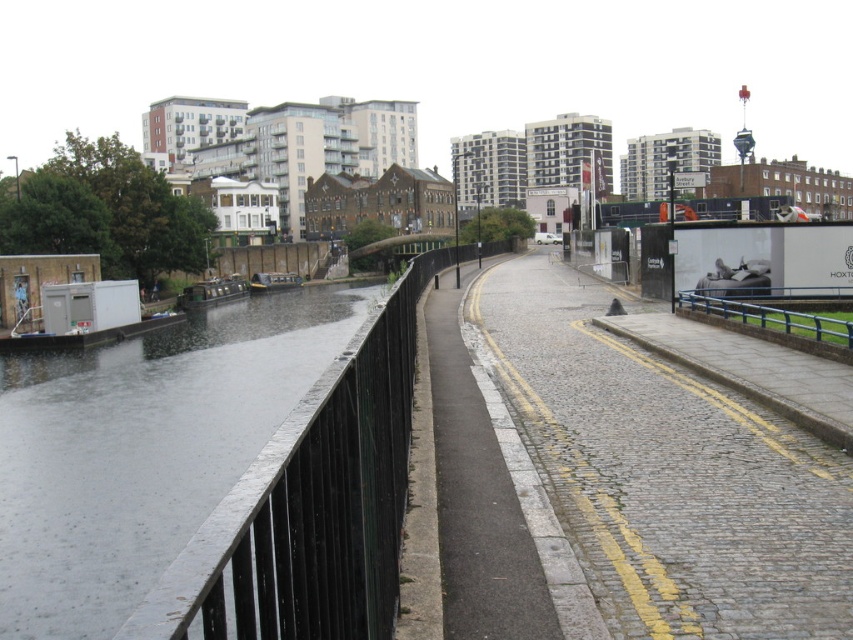
Does black metal water at left appear on the left side of black metal fence at left?

Yes, black metal water at left is to the left of black metal fence at left.

Does black metal water at left have a lesser height compared to black metal fence at left?

Correct, black metal water at left is not as tall as black metal fence at left.

Which is in front, point (334, 321) or point (409, 340)?

Point (409, 340) is more forward.

Find the location of a particular element. This screenshot has height=640, width=853. black metal water at left is located at coordinates (143, 449).

Can you confirm if blue metallic rail at right is positioned below green matte canal boat at left?

Indeed, blue metallic rail at right is positioned under green matte canal boat at left.

Based on the photo, who is positioned more to the right, blue metallic rail at right or green matte canal boat at left?

blue metallic rail at right is more to the right.

Find the location of a particular element. blue metallic rail at right is located at coordinates (772, 317).

Does black metal fence at left lie behind green matte boat at left?

No, black metal fence at left is closer to the viewer.

How distant is black metal fence at left from green matte boat at left?

A distance of 34.50 meters exists between black metal fence at left and green matte boat at left.

Which is in front, point (490, 241) or point (196, 282)?

Point (490, 241) is in front.

Identify the location of black metal fence at left. The image size is (853, 640). (321, 496).